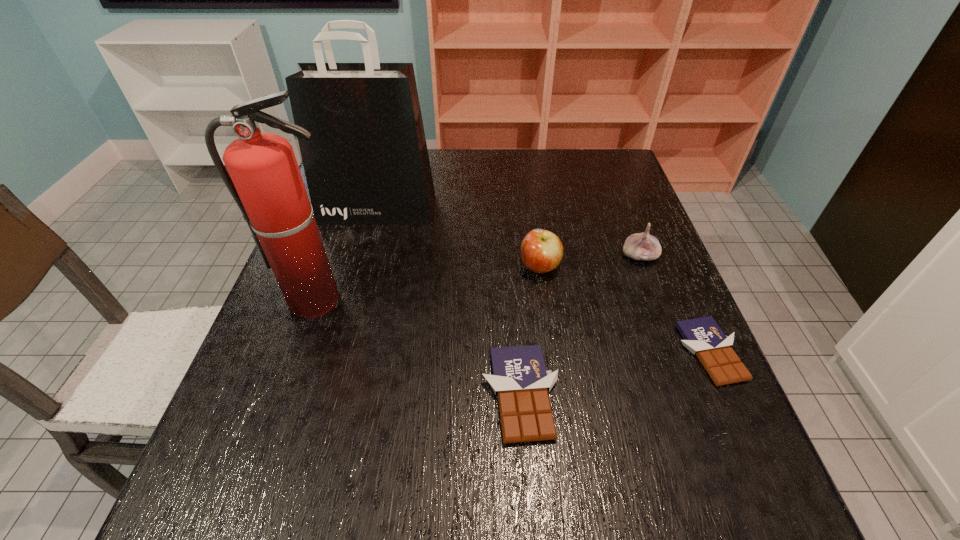
At what (x,y) coordinates should I click in order to perform the action: click on free space at the near edge of the desktop. Please return your answer as a coordinate pair (x, y). Looking at the image, I should click on (383, 438).

Locate an element on the screen. This screenshot has height=540, width=960. free location at the right edge of the desktop is located at coordinates (618, 214).

In the image, there is a desktop. Where is `vacant space at the near left corner`? Image resolution: width=960 pixels, height=540 pixels. vacant space at the near left corner is located at coordinates (300, 435).

Find the location of a particular element. The width and height of the screenshot is (960, 540). free spot at the far right corner of the desktop is located at coordinates (584, 176).

In order to click on vacant space that is in between the taller chocolate bar and the shorter chocolate bar in this screenshot , I will do `click(614, 374)`.

The width and height of the screenshot is (960, 540). In order to click on vacant area that lies between the fire extinguisher and the apple in this screenshot , I will do `click(428, 284)`.

This screenshot has height=540, width=960. Find the location of `empty space that is in between the apple and the fire extinguisher`. empty space that is in between the apple and the fire extinguisher is located at coordinates (428, 284).

Find the location of a particular element. vacant space that is in between the garlic and the farthest object is located at coordinates (509, 233).

This screenshot has width=960, height=540. What are the coordinates of `unoccupied area between the shortest object and the garlic` in the screenshot? It's located at (674, 305).

In order to click on free space between the taller chocolate bar and the fire extinguisher in this screenshot , I will do `click(419, 347)`.